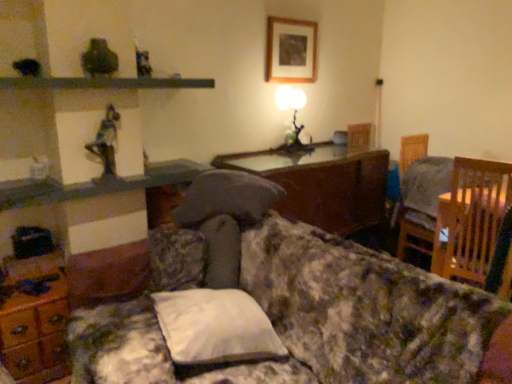
Where is `free location to the left of metallic statue at upper left`? free location to the left of metallic statue at upper left is located at coordinates (77, 178).